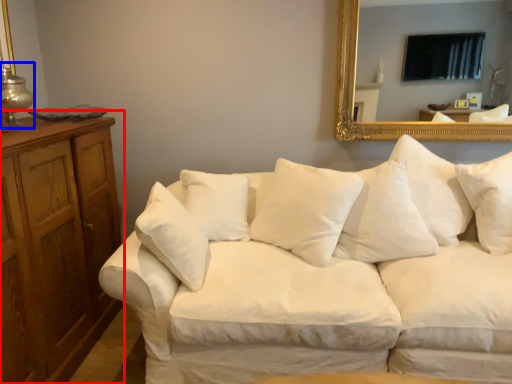
Question: Among these objects, which one is farthest to the camera, dresser (highlighted by a red box) or table lamp (highlighted by a blue box)?

Choices:
 (A) dresser
 (B) table lamp

Answer: (B)